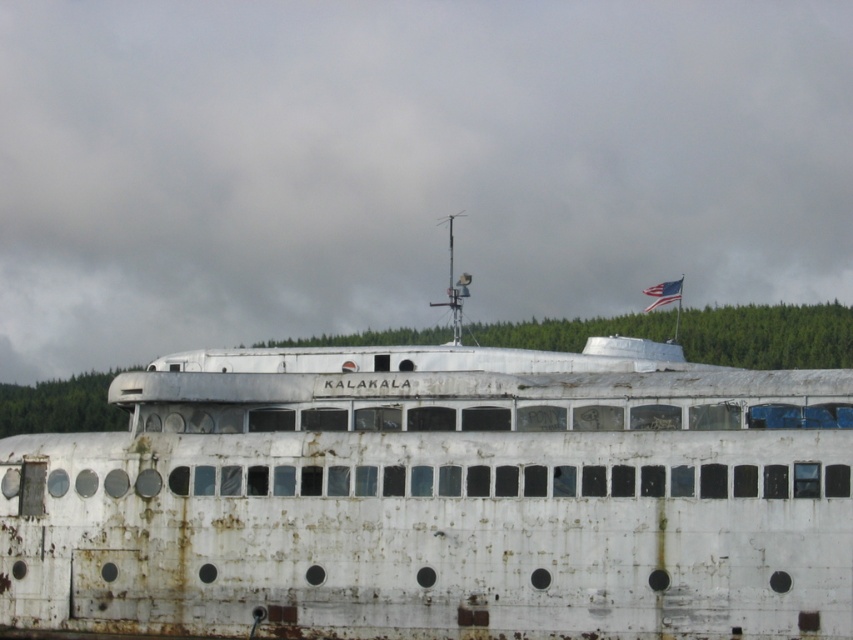
Question: Does rusty white ship at center come behind american flag at upper center?

Choices:
 (A) no
 (B) yes

Answer: (A)

Question: Can you confirm if rusty white ship at center is positioned to the left of american flag at upper center?

Choices:
 (A) no
 (B) yes

Answer: (B)

Question: Which object is farther from the camera taking this photo?

Choices:
 (A) american flag at upper center
 (B) rusty white ship at center

Answer: (A)

Question: Is rusty white ship at center below american flag at upper center?

Choices:
 (A) no
 (B) yes

Answer: (B)